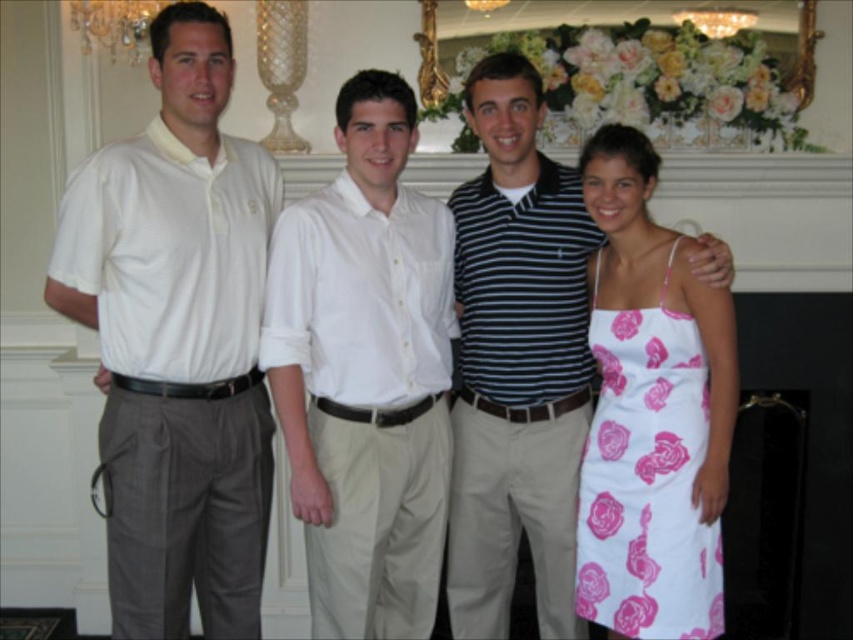
Is point (170, 316) positioned after point (445, 244)?

No.

Who is more distant from viewer, [80,202] or [299,515]?

Positioned behind is point [299,515].

I want to click on white cotton shirt at left, so click(x=177, y=340).

Locate an element on the screen. The image size is (853, 640). white cotton shirt at left is located at coordinates (177, 340).

Who is higher up, white cotton shirt at left or striped polo shirt at center?

white cotton shirt at left is higher up.

At what (x,y) coordinates should I click in order to perform the action: click on white cotton shirt at left. Please return your answer as a coordinate pair (x, y). Image resolution: width=853 pixels, height=640 pixels. Looking at the image, I should click on (177, 340).

Between white cotton shirt at left and crystal chandelier at upper left, which one has more height?

white cotton shirt at left

Between point (146, 372) and point (112, 1), which one is positioned in front?

Point (146, 372) is in front.

Where is `white cotton shirt at left`? This screenshot has width=853, height=640. white cotton shirt at left is located at coordinates (177, 340).